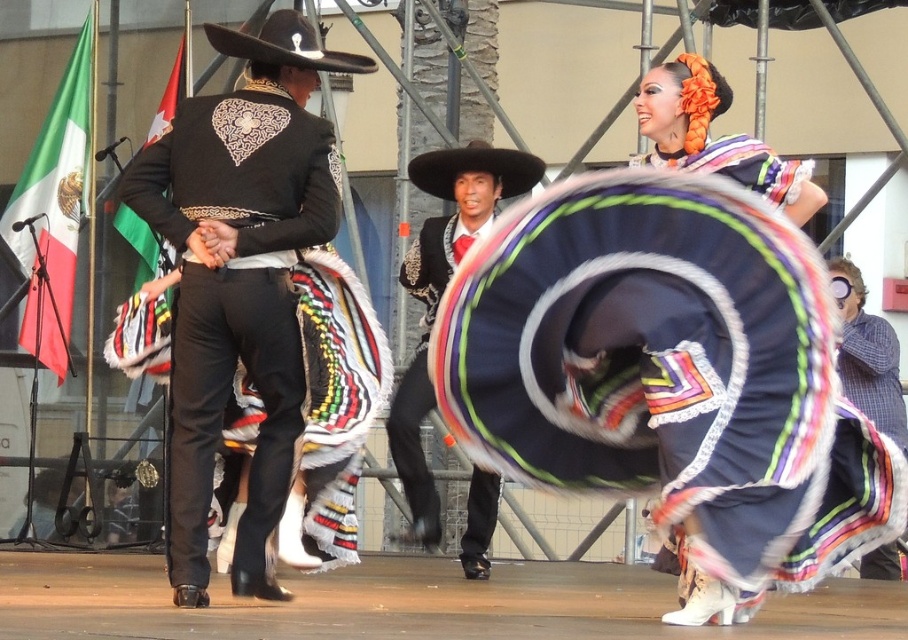
Which is in front, point (306, 285) or point (53, 353)?

Point (306, 285) is in front.

Does point (302, 525) come behind point (26, 337)?

No, it is in front of (26, 337).

Where is `black satin vest at center`? black satin vest at center is located at coordinates (285, 284).

Is velvet dark blue sombrero at center thinner than matte black sombrero at center?

No.

How distant is velvet dark blue sombrero at center from matte black sombrero at center?

velvet dark blue sombrero at center and matte black sombrero at center are 7.43 meters apart.

Measure the distance between point [642,445] and camera.

The distance of point [642,445] from camera is 21.05 meters.

The height and width of the screenshot is (640, 908). I want to click on velvet dark blue sombrero at center, so click(668, 371).

Is point (36, 355) positioned after point (278, 36)?

Yes, point (36, 355) is behind point (278, 36).

Find the location of a particular element. The height and width of the screenshot is (640, 908). green-white-red fabric flag at left is located at coordinates (54, 208).